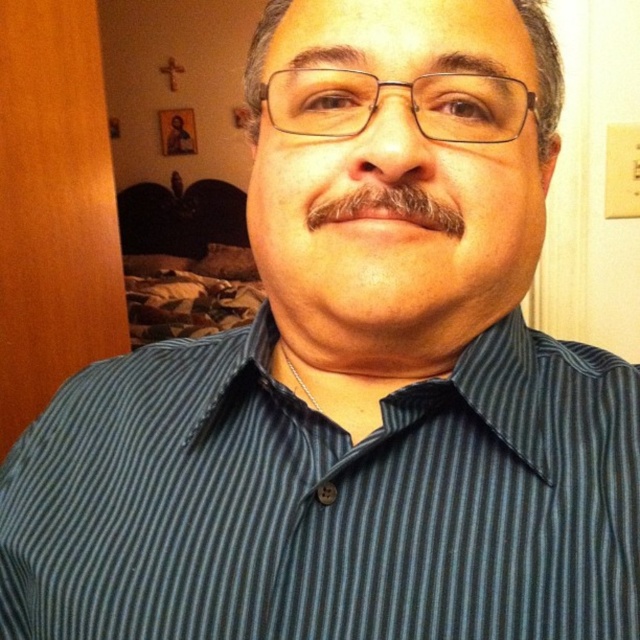
You are standing in the room and want to reach the point marked as point (93,513). To do this, you must first pass through point (422,212). Is this path possible?

Yes, because point (93,513) is behind point (422,212), so you must pass through point (422,212) to reach it.

You are a photographer adjusting the focus on your camera. You want to capture both the dark blue striped shirt at center and the dark brown fuzzy mustache at center in sharp detail. What is the minimum distance your camera lens should be set to focus on to ensure both are in focus?

The dark blue striped shirt at center and dark brown fuzzy mustache at center are 18.60 centimeters apart from each other. To ensure both are in focus, the camera lens should be set to a focal distance that accommodates this distance, typically by focusing at the midpoint between them or using a smaller aperture for greater depth of field.